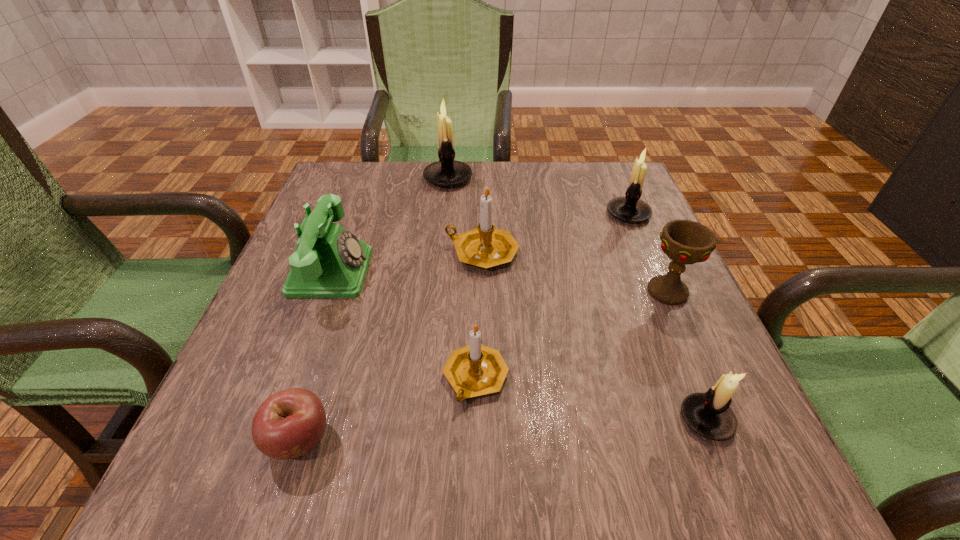
At what (x,y) coordinates should I click in order to perform the action: click on vacant position at the near left corner of the desktop. Please return your answer as a coordinate pair (x, y). The height and width of the screenshot is (540, 960). Looking at the image, I should click on click(x=223, y=481).

At what (x,y) coordinates should I click in order to perform the action: click on blank space at the far right corner of the desktop. Please return your answer as a coordinate pair (x, y). Looking at the image, I should click on (581, 161).

Identify the location of empty space between the apple and the telephone. (315, 356).

The image size is (960, 540). Find the location of `vacant space that is in between the fourth nearest candle holder and the shortest object`. vacant space that is in between the fourth nearest candle holder and the shortest object is located at coordinates (464, 327).

Image resolution: width=960 pixels, height=540 pixels. Identify the location of vacant space that's between the shortest object and the seventh nearest object. (464, 327).

Where is `vacant point located between the telephone and the red chalice`? The image size is (960, 540). vacant point located between the telephone and the red chalice is located at coordinates (499, 281).

I want to click on free space between the leftmost white candle holder and the nearest white candle holder, so click(577, 299).

Where is `free spot between the tallest object and the nearer gold candle holder`? The width and height of the screenshot is (960, 540). free spot between the tallest object and the nearer gold candle holder is located at coordinates (462, 278).

Locate an element on the screen. Image resolution: width=960 pixels, height=540 pixels. vacant space that's between the second biggest white candle holder and the nearest white candle holder is located at coordinates (667, 316).

This screenshot has width=960, height=540. Find the location of `free spot between the smallest white candle holder and the smaller gold candle holder`. free spot between the smallest white candle holder and the smaller gold candle holder is located at coordinates (591, 399).